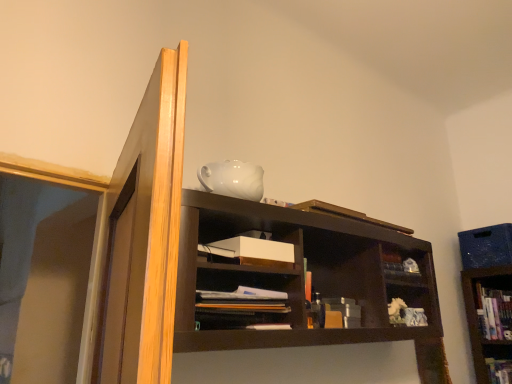
Question: Can you confirm if matte brown books at center is thinner than hardcover book at upper right, which appears as the 2th book when viewed from the top?

Choices:
 (A) no
 (B) yes

Answer: (B)

Question: Does matte brown books at center have a lesser height compared to hardcover book at upper right, which appears as the 2th book when viewed from the top?

Choices:
 (A) yes
 (B) no

Answer: (A)

Question: From the image's perspective, would you say matte brown books at center is positioned over hardcover book at upper right, acting as the third book starting from the left?

Choices:
 (A) no
 (B) yes

Answer: (B)

Question: From the image's perspective, is matte brown books at center beneath hardcover book at upper right, positioned as the 3th book in front-to-back order?

Choices:
 (A) no
 (B) yes

Answer: (A)

Question: Does matte brown books at center appear on the right side of hardcover book at upper right, which is counted as the first book, starting from the right?

Choices:
 (A) yes
 (B) no

Answer: (B)

Question: In terms of size, does white matte paper at center appear bigger or smaller than wooden book at upper center, which is counted as the first book, starting from the front?

Choices:
 (A) big
 (B) small

Answer: (A)

Question: Considering the relative positions of white matte paper at center and wooden book at upper center, the 3th book in the bottom-to-top sequence, in the image provided, is white matte paper at center to the left or to the right of wooden book at upper center, the 3th book in the bottom-to-top sequence,?

Choices:
 (A) right
 (B) left

Answer: (B)

Question: Is white matte paper at center situated inside wooden book at upper center, which is the 1th book in left-to-right order, or outside?

Choices:
 (A) outside
 (B) inside

Answer: (A)

Question: Is white matte paper at center in front of or behind wooden book at upper center, the 3th book when ordered from right to left, in the image?

Choices:
 (A) front
 (B) behind

Answer: (A)

Question: From a real-world perspective, relative to multicolored fabric book at upper center, which ranks as the 3th book in top-to-bottom order, is white matte paper at center vertically above or below?

Choices:
 (A) above
 (B) below

Answer: (A)

Question: From the image's perspective, relative to multicolored fabric book at upper center, arranged as the 1th book when ordered from the bottom, is white matte paper at center above or below?

Choices:
 (A) below
 (B) above

Answer: (B)

Question: Is white matte paper at center inside the boundaries of multicolored fabric book at upper center, positioned as the second book in left-to-right order, or outside?

Choices:
 (A) inside
 (B) outside

Answer: (B)

Question: Is white matte paper at center taller or shorter than multicolored fabric book at upper center, arranged as the 1th book when ordered from the bottom?

Choices:
 (A) short
 (B) tall

Answer: (A)

Question: Is hardcover book at upper right, which appears as the 2th book when viewed from the top, to the left or to the right of matte brown books at center in the image?

Choices:
 (A) left
 (B) right

Answer: (B)

Question: Is hardcover book at upper right, positioned as the 3th book in front-to-back order, in front of or behind matte brown books at center in the image?

Choices:
 (A) front
 (B) behind

Answer: (B)